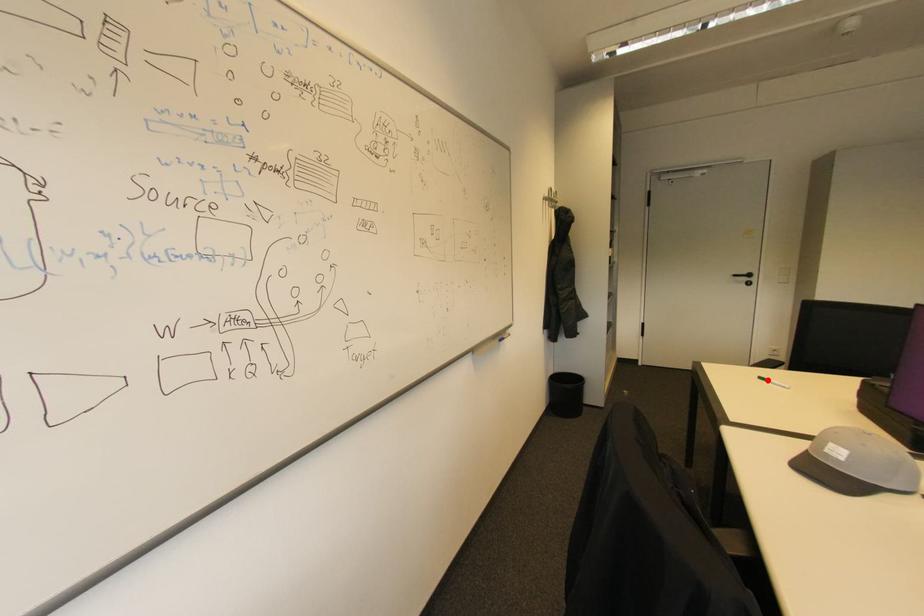
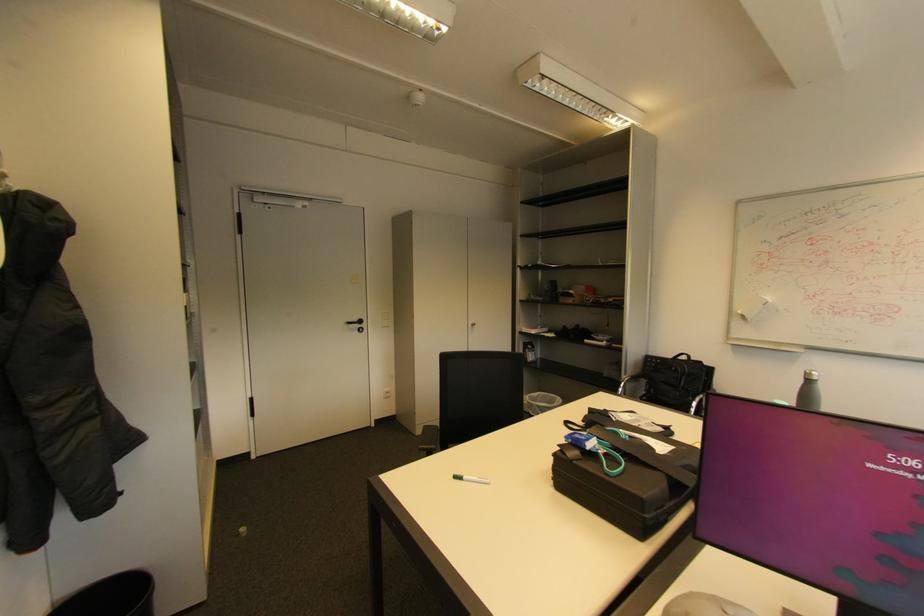
Question: I am providing you with two images of the same scene from different viewpoints. Given a red point in image1, look at the same physical point in image2. Is it:

Choices:
 (A) Closer to the viewpoint
 (B) Farther from the viewpoint

Answer: (A)